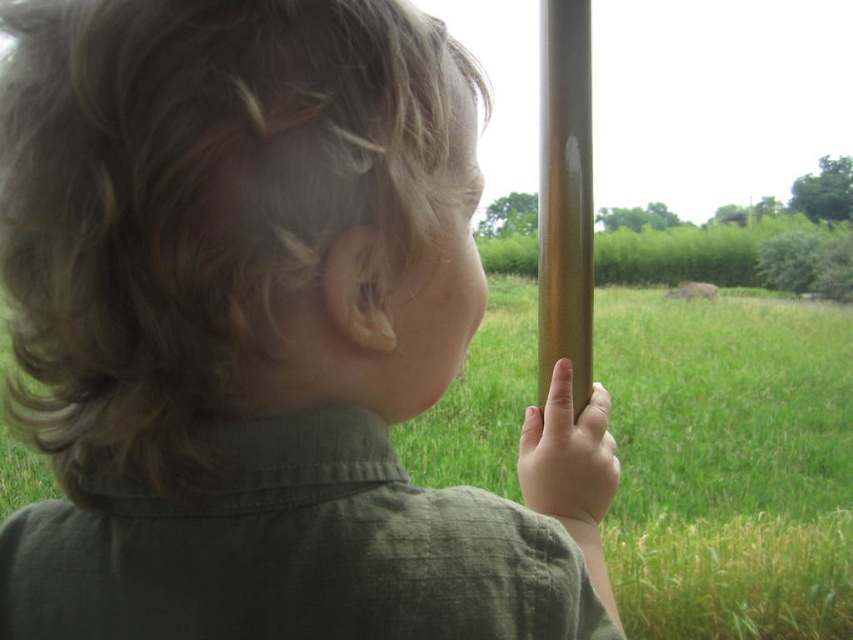
The width and height of the screenshot is (853, 640). Describe the element at coordinates (564, 196) in the screenshot. I see `shiny metallic pole at center` at that location.

In the scene shown: Can you confirm if shiny metallic pole at center is positioned to the left of pink matte finger at center?

Incorrect, shiny metallic pole at center is not on the left side of pink matte finger at center.

Does point (566, 284) come behind point (550, 397)?

Yes.

This screenshot has height=640, width=853. Find the location of `shiny metallic pole at center`. shiny metallic pole at center is located at coordinates (564, 196).

Which is below, matte green shirt at center or pink matte finger at center?

pink matte finger at center is below.

Which is behind, point (363, 326) or point (592, 426)?

The point (592, 426) is more distant.

Does point (85, 252) come in front of point (564, 483)?

That is True.

The width and height of the screenshot is (853, 640). In order to click on matte green shirt at center in this screenshot , I will do `click(252, 330)`.

Is green grass at center to the left of pink matte finger at center from the viewer's perspective?

In fact, green grass at center is to the right of pink matte finger at center.

Is green grass at center taller than pink matte finger at center?

Yes, green grass at center is taller than pink matte finger at center.

At what (x,y) coordinates should I click in order to perform the action: click on green grass at center. Please return your answer as a coordinate pair (x, y). Looking at the image, I should click on (729, 464).

This screenshot has width=853, height=640. In order to click on green grass at center in this screenshot , I will do `click(729, 464)`.